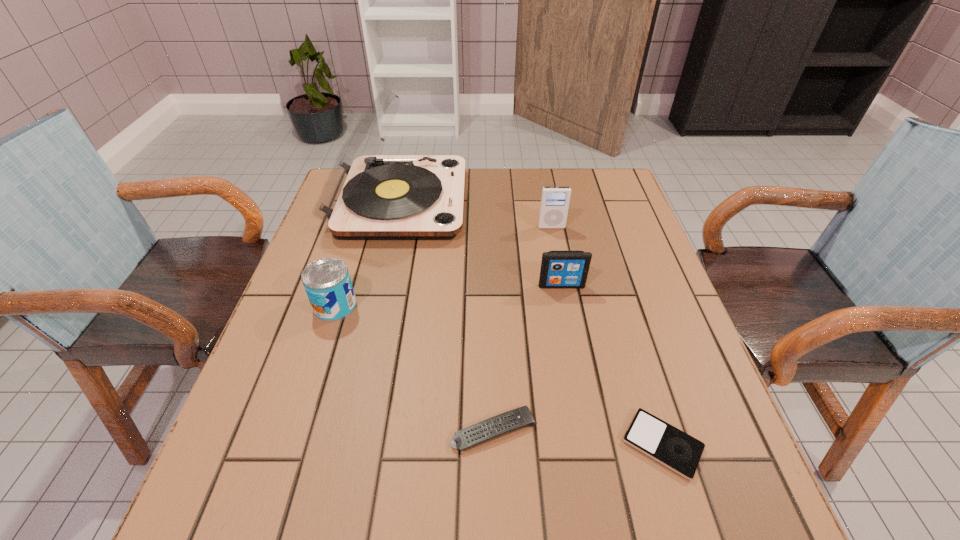
At what (x,y) coordinates should I click in order to perform the action: click on free spot that satisfies the following two spatial constraints: 1. with the tonearm facing the front of the tallest object; 2. on the left side of the shortest object. Please return your answer as a coordinate pair (x, y). Looking at the image, I should click on (343, 444).

I want to click on vacant space that satisfies the following two spatial constraints: 1. with the tonearm facing the front of the rightmost object; 2. on the right side of the tallest object, so click(x=343, y=444).

The image size is (960, 540). What are the coordinates of `blank area in the image that satisfies the following two spatial constraints: 1. with the tonearm facing the front of the record player; 2. on the right side of the remote control` in the screenshot? It's located at (347, 430).

Locate an element on the screen. free spot that satisfies the following two spatial constraints: 1. on the front-facing side of the second tallest object; 2. on the right side of the nearest iPod is located at coordinates (592, 444).